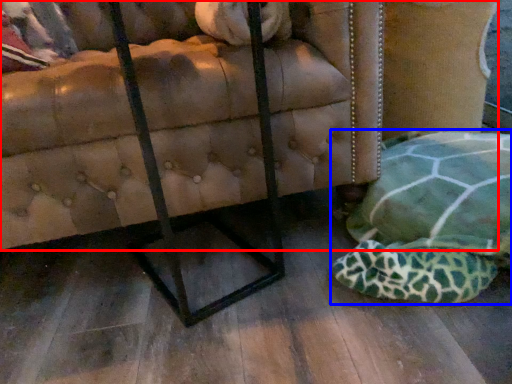
Question: Which object appears farthest to the camera in this image, furniture (highlighted by a red box) or swivel chair (highlighted by a blue box)?

Choices:
 (A) furniture
 (B) swivel chair

Answer: (A)